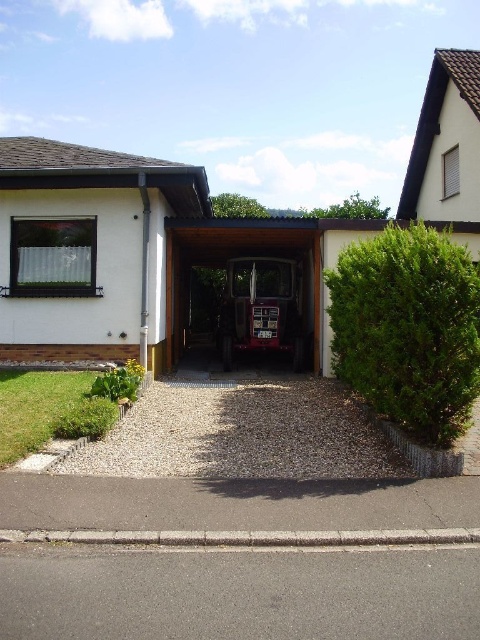
Question: Can you confirm if green leafy hedge at right is positioned above metallic red tractor at center?

Choices:
 (A) yes
 (B) no

Answer: (A)

Question: In this image, where is green leafy hedge at right located relative to metallic red tractor at center?

Choices:
 (A) right
 (B) left

Answer: (A)

Question: Where is green leafy hedge at right located in relation to metallic red car at center in the image?

Choices:
 (A) below
 (B) above

Answer: (A)

Question: Which object is the closest to the green leafy hedge at right?

Choices:
 (A) metallic red car at center
 (B) asphalt at lower center
 (C) metallic red tractor at center

Answer: (B)

Question: Which of the following is the farthest from the observer?

Choices:
 (A) metallic red tractor at center
 (B) metallic red car at center
 (C) asphalt at lower center

Answer: (B)

Question: Which of the following is the farthest from the observer?

Choices:
 (A) green leafy hedge at right
 (B) metallic red tractor at center

Answer: (B)